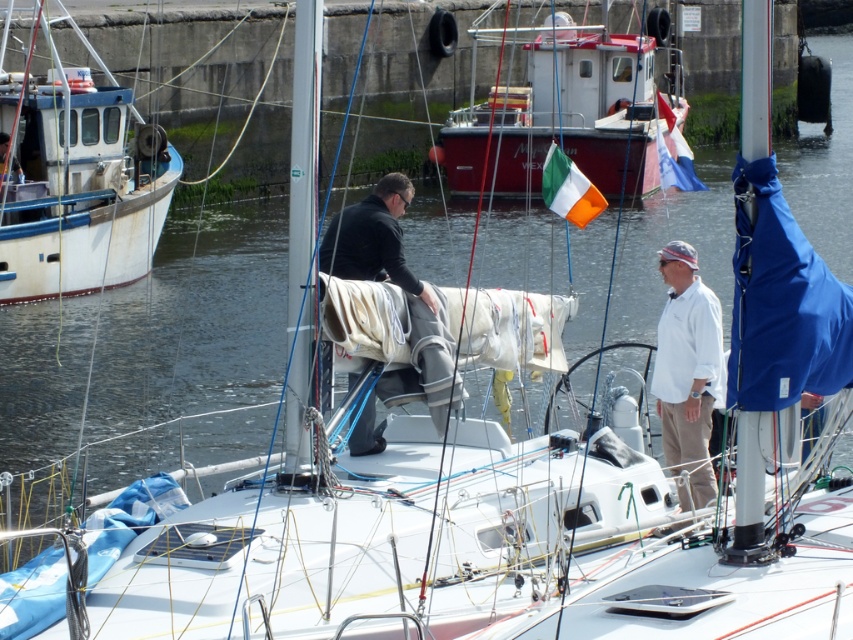
Question: Which point appears closest to the camera in this image?

Choices:
 (A) (676, 436)
 (B) (611, 38)
 (C) (404, 182)

Answer: (C)

Question: From the image, what is the correct spatial relationship of white matte boat at left in relation to white cotton shirt at center?

Choices:
 (A) below
 (B) above

Answer: (B)

Question: Does white matte boat at left have a smaller size compared to dark gray fabric sail at center?

Choices:
 (A) yes
 (B) no

Answer: (A)

Question: Can you confirm if red metallic boat at upper center is thinner than dark gray fabric sail at center?

Choices:
 (A) yes
 (B) no

Answer: (B)

Question: Which point appears closest to the camera in this image?

Choices:
 (A) (503, 97)
 (B) (148, 161)
 (C) (685, 260)

Answer: (C)

Question: Which object is closer to the camera taking this photo?

Choices:
 (A) white matte boat at left
 (B) red metallic boat at upper center
 (C) white cotton shirt at center
 (D) dark gray fabric sail at center

Answer: (D)